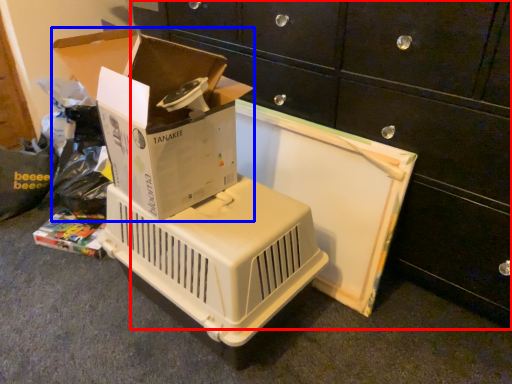
Question: Which of the following is the farthest to the observer, furniture (highlighted by a red box) or box (highlighted by a blue box)?

Choices:
 (A) furniture
 (B) box

Answer: (B)